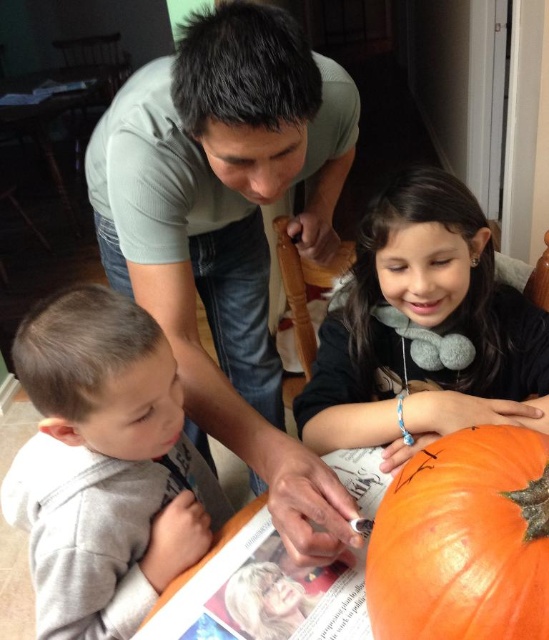
Question: Does orange pumpkin at lower center appear under matte orange pumpkin at center?

Choices:
 (A) no
 (B) yes

Answer: (B)

Question: Which point is closer to the camera?

Choices:
 (A) orange matte pumpkin at lower right
 (B) orange pumpkin at lower center
 (C) matte green shirt at upper center

Answer: (A)

Question: Is matte green shirt at upper center thinner than matte orange pumpkin at center?

Choices:
 (A) no
 (B) yes

Answer: (A)

Question: Is matte green shirt at upper center positioned behind orange matte pumpkin at lower right?

Choices:
 (A) yes
 (B) no

Answer: (A)

Question: Which of the following is the farthest from the observer?

Choices:
 (A) gray fleece shirt at lower left
 (B) orange pumpkin at lower center
 (C) matte orange pumpkin at center
 (D) matte green shirt at upper center

Answer: (C)

Question: Which is nearer to the orange pumpkin at lower center?

Choices:
 (A) matte green shirt at upper center
 (B) gray fleece shirt at lower left
 (C) matte orange pumpkin at center

Answer: (B)